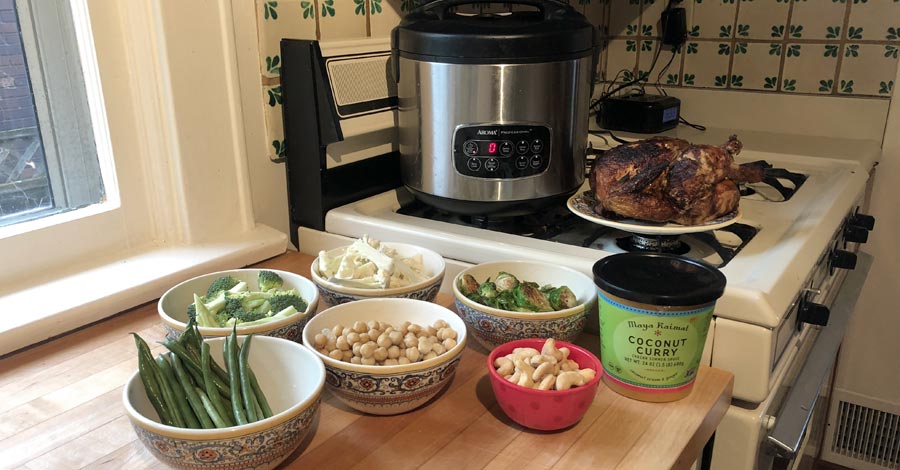
Find the location of a particular element. cooker is located at coordinates (464, 82).